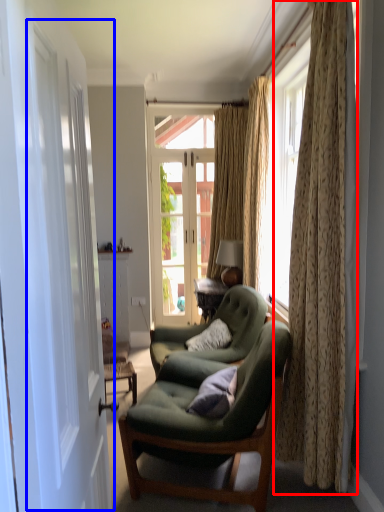
Question: Which object is closer to the camera taking this photo, curtain (highlighted by a red box) or screen door (highlighted by a blue box)?

Choices:
 (A) curtain
 (B) screen door

Answer: (B)